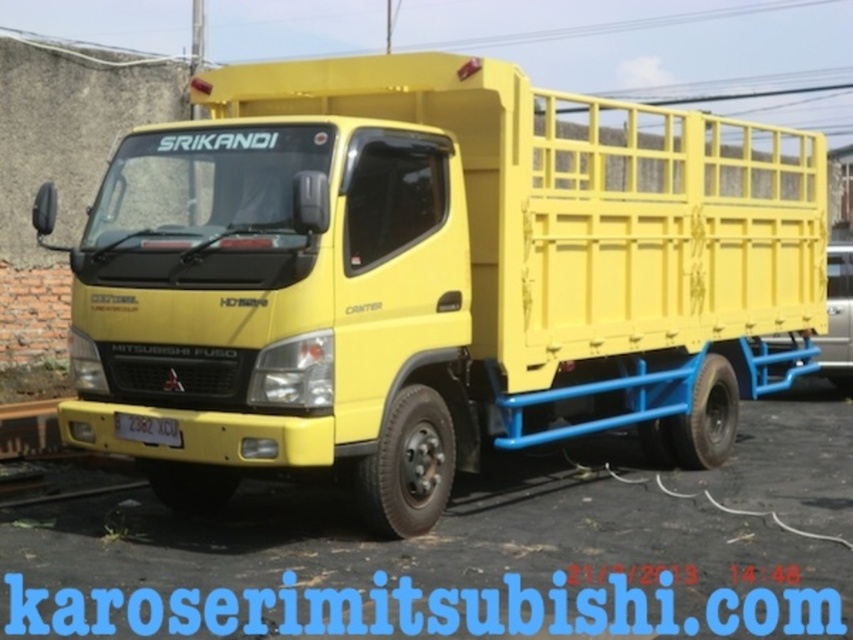
Who is positioned more to the right, matte yellow truck at center or black plastic license plate at center?

From the viewer's perspective, matte yellow truck at center appears more on the right side.

Is matte yellow truck at center below black plastic license plate at center?

No.

Between point (679, 225) and point (151, 419), which one is positioned behind?

The point (679, 225) is more distant.

Find the location of `matte yellow truck at center`. matte yellow truck at center is located at coordinates (434, 276).

Between yellow metal train track at lower left and black plastic license plate at center, which one is positioned lower?

yellow metal train track at lower left

Which of these two, yellow metal train track at lower left or black plastic license plate at center, stands shorter?

black plastic license plate at center is shorter.

Is point (15, 420) more distant than point (167, 429)?

Yes.

This screenshot has height=640, width=853. I want to click on yellow metal train track at lower left, so click(44, 436).

Is matte yellow truck at center below yellow metal train track at lower left?

Incorrect, matte yellow truck at center is not positioned below yellow metal train track at lower left.

Which is in front, point (660, 264) or point (7, 484)?

Point (7, 484)

Locate an element on the screen. This screenshot has height=640, width=853. matte yellow truck at center is located at coordinates (434, 276).